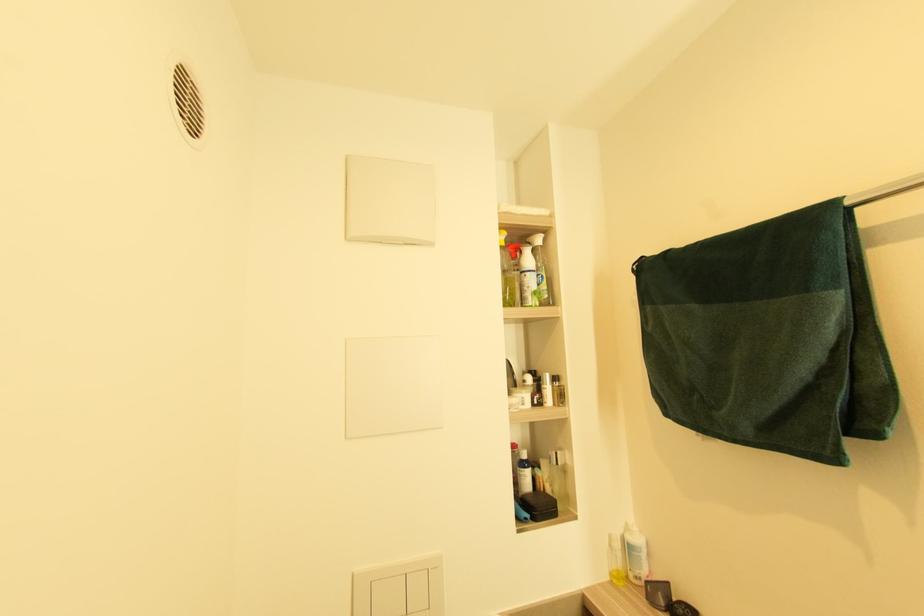
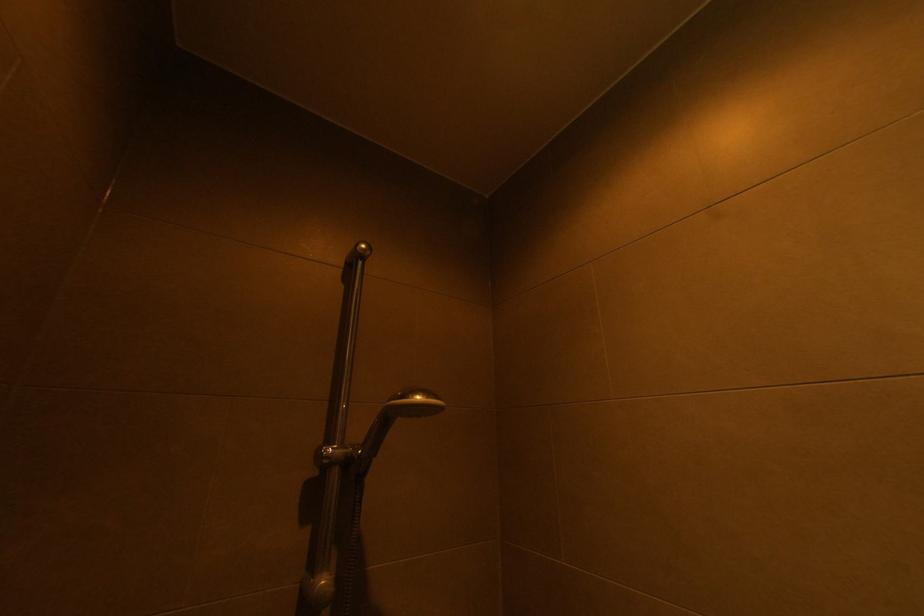
The first image is from the beginning of the video and the second image is from the end. How did the camera likely rotate when shooting the video?

The rotation direction of the camera is right-up.